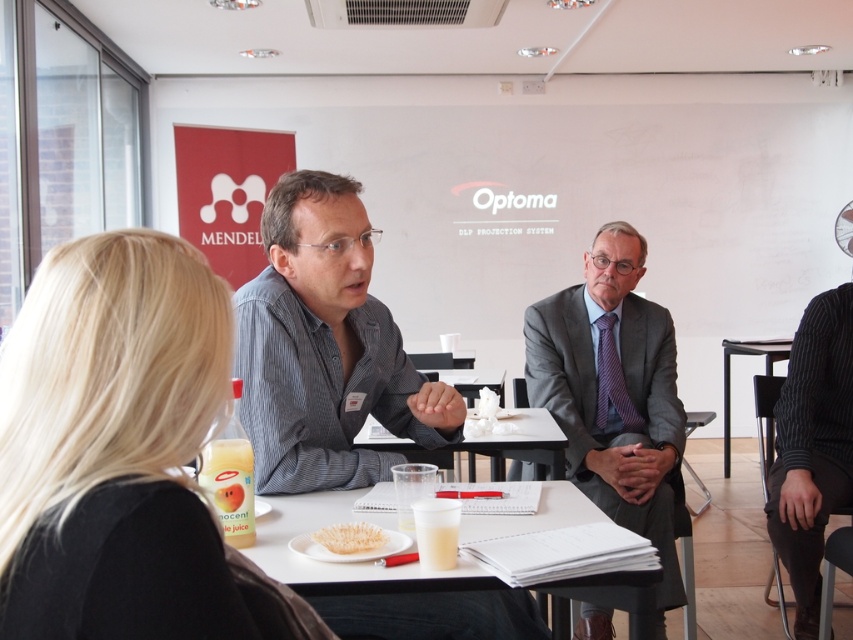
You are attending a conference and notice two people at the front of the room. One has blonde hair at upper left and the other is wearing a gray suit at center. Which person has a thinner appearance?

The blonde hair at upper left is thinner than the gray suit at center, so the person with blonde hair at upper left has a thinner appearance.

Consider the image. You are attending a conference and need to present your slides. You see the blonde hair at upper left and the white paper at center. Which object is closer to the left side of the table?

The blonde hair at upper left is closer to the left side of the table since it is positioned on the left side of the white paper at center.

You are attending a conference in the room described. You need to determine if the blonde hair at upper left can fit under the black plastic table at lower right without bending. Can it?

The blonde hair at upper left is not as tall as the black plastic table at lower right, so it can fit under the table without bending.